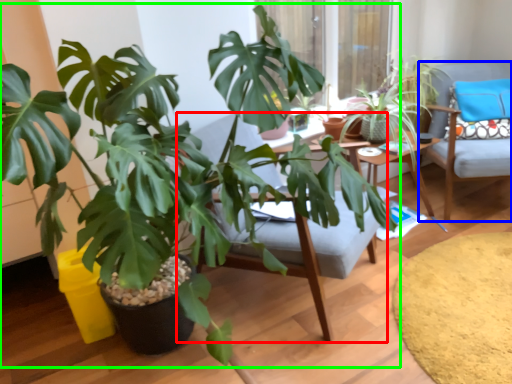
Question: Which object is positioned closest to swivel chair (highlighted by a red box)? Select from chair (highlighted by a blue box) and houseplant (highlighted by a green box).

Choices:
 (A) chair
 (B) houseplant

Answer: (B)